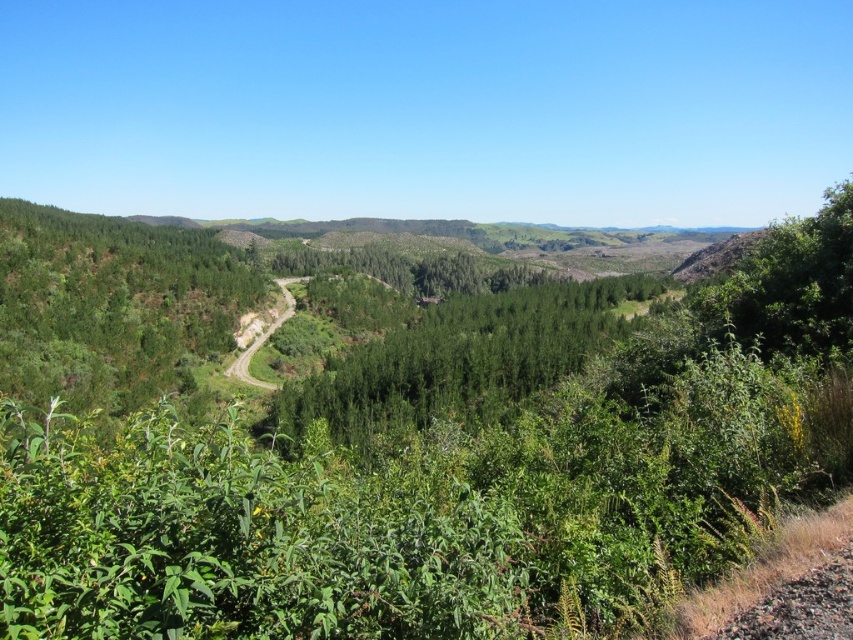
You are standing at the point closer to the camera in this landscape scene. Which point are you at, point (194, 230) or point (851, 540)?

You are at point (194, 230) because it is further to the camera than point (851, 540).

You are a hiker planning to walk along the brown gravel dirt track at lower right. You notice the green leafy tree at left nearby. Can you determine which one is taller?

The green leafy tree at left is taller than the brown gravel dirt track at lower right.